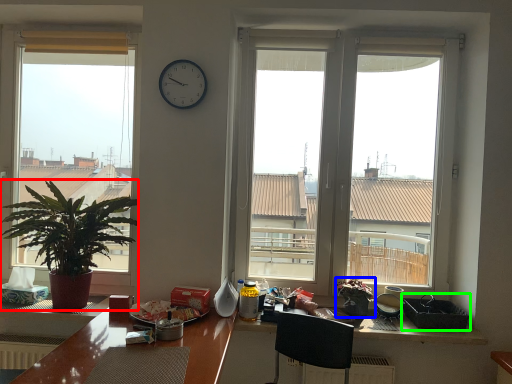
Question: Which object is positioned farthest from houseplant (highlighted by a red box)? Select from houseplant (highlighted by a blue box) and picnic basket (highlighted by a green box).

Choices:
 (A) houseplant
 (B) picnic basket

Answer: (B)